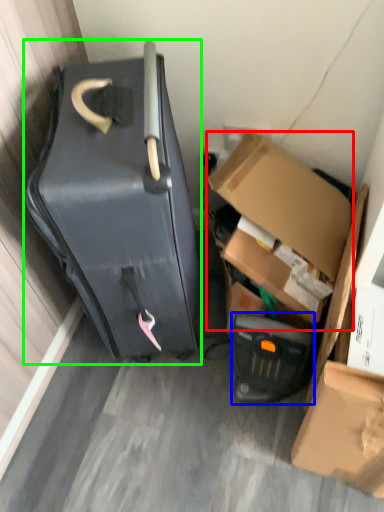
Question: Considering the real-world distances, which object is closest to box (highlighted by a red box)? appliance (highlighted by a blue box) or suitcase (highlighted by a green box).

Choices:
 (A) appliance
 (B) suitcase

Answer: (A)